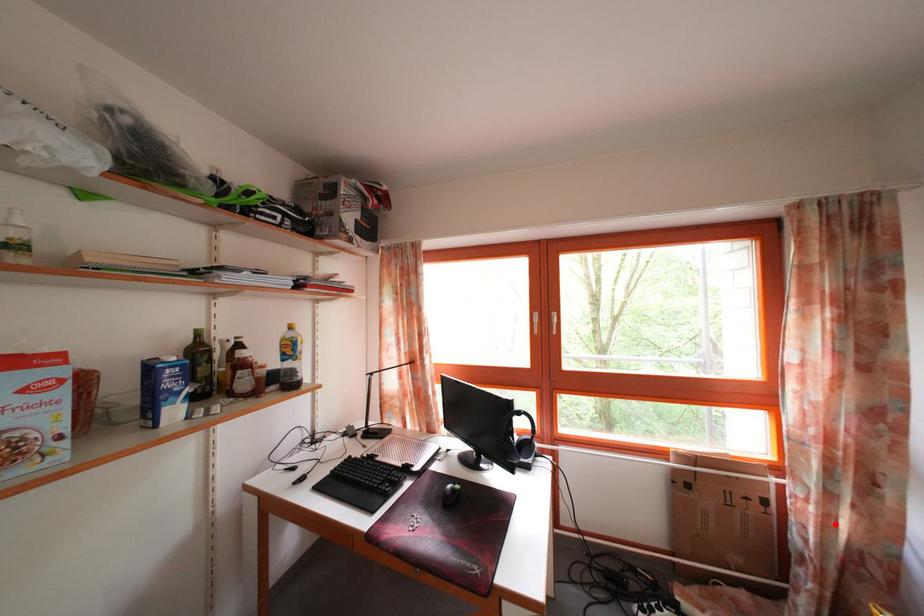
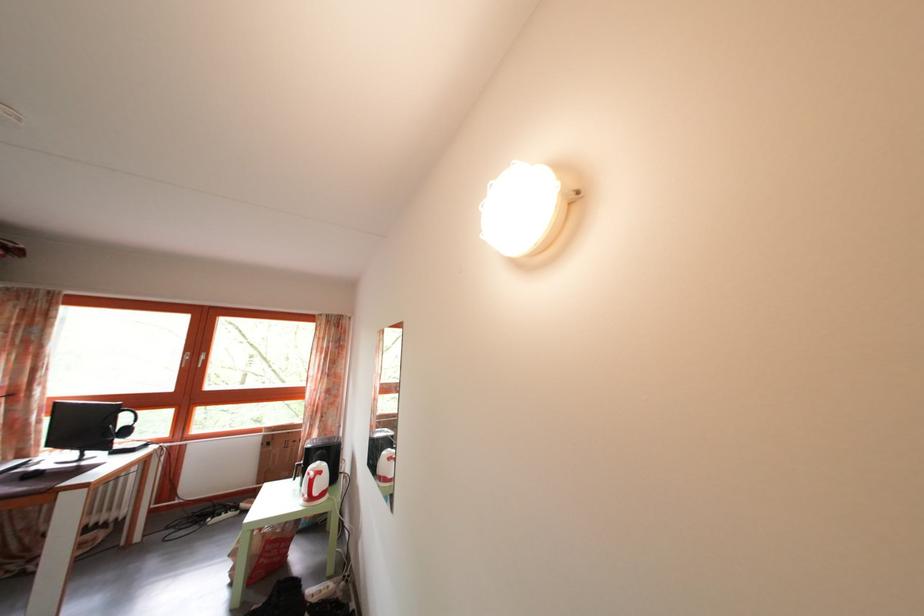
Question: I am providing you with two images of the same scene from different viewpoints. In image1, a red point is highlighted. Considering the same 3D point in image2, which of the following is correct?

Choices:
 (A) It is closer
 (B) It is farther

Answer: (B)